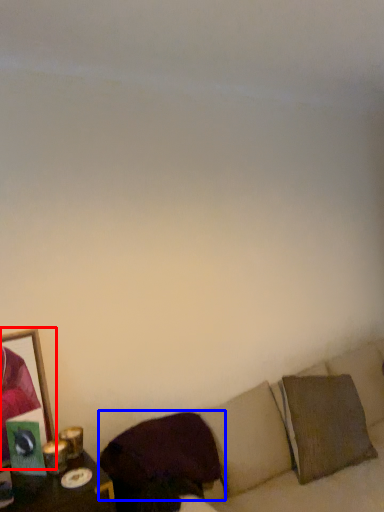
Question: Which object is further to the camera taking this photo, picture frame (highlighted by a red box) or pillow (highlighted by a blue box)?

Choices:
 (A) picture frame
 (B) pillow

Answer: (A)